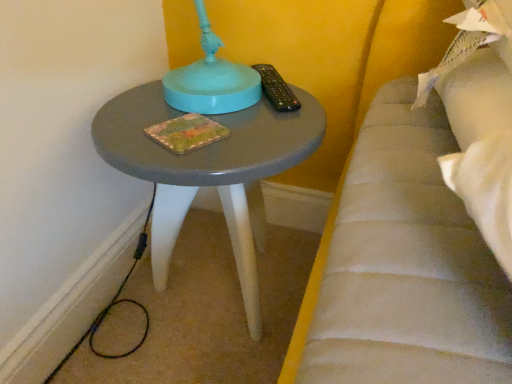
What do you see at coordinates (209, 171) in the screenshot? Image resolution: width=512 pixels, height=384 pixels. I see `matte gray table at center` at bounding box center [209, 171].

Identify the location of matte gray table at center. This screenshot has height=384, width=512. (209, 171).

Identify the location of black plastic remote at upper right. (276, 89).

The width and height of the screenshot is (512, 384). What do you see at coordinates (276, 89) in the screenshot?
I see `black plastic remote at upper right` at bounding box center [276, 89].

Locate an element on the screen. The image size is (512, 384). matte gray table at center is located at coordinates (209, 171).

Does matte gray table at center appear on the left side of black plastic remote at upper right?

Yes.

Which is in front, matte gray table at center or black plastic remote at upper right?

matte gray table at center is closer to the camera.

Is point (153, 211) positioned before point (260, 66)?

That is False.

From the image's perspective, which is above, matte gray table at center or black plastic remote at upper right?

black plastic remote at upper right.

From a real-world perspective, between matte gray table at center and black plastic remote at upper right, who is vertically lower?

matte gray table at center is physically lower.

Is matte gray table at center wider than black plastic remote at upper right?

Correct, the width of matte gray table at center exceeds that of black plastic remote at upper right.

Considering the relative sizes of matte gray table at center and black plastic remote at upper right in the image provided, is matte gray table at center shorter than black plastic remote at upper right?

No, matte gray table at center is not shorter than black plastic remote at upper right.

Considering the sizes of objects matte gray table at center and black plastic remote at upper right in the image provided, who is smaller, matte gray table at center or black plastic remote at upper right?

With smaller size is black plastic remote at upper right.

Do you think matte gray table at center is within black plastic remote at upper right, or outside of it?

matte gray table at center is spatially situated outside black plastic remote at upper right.

Can you see matte gray table at center touching black plastic remote at upper right?

No, matte gray table at center is not next to black plastic remote at upper right.

Is matte gray table at center positioned with its back to black plastic remote at upper right?

matte gray table at center is not turned away from black plastic remote at upper right.

Based on the photo, how far apart are matte gray table at center and black plastic remote at upper right?

matte gray table at center is 8.17 inches away from black plastic remote at upper right.

Locate an element on the screen. table below the black plastic remote at upper right (from a real-world perspective) is located at coordinates (209, 171).

Considering the positions of objects black plastic remote at upper right and matte gray table at center in the image provided, who is more to the left, black plastic remote at upper right or matte gray table at center?

From the viewer's perspective, matte gray table at center appears more on the left side.

Relative to matte gray table at center, is black plastic remote at upper right in front or behind?

Clearly, black plastic remote at upper right is behind matte gray table at center.

Considering the positions of point (274, 77) and point (119, 152), is point (274, 77) closer or farther from the camera than point (119, 152)?

Point (274, 77) appears to be farther away from the viewer than point (119, 152).

From the image's perspective, between black plastic remote at upper right and matte gray table at center, who is located below?

matte gray table at center is shown below in the image.

From a real-world perspective, does black plastic remote at upper right sit lower than matte gray table at center?

Actually, black plastic remote at upper right is physically above matte gray table at center in the real world.

Which of these two, black plastic remote at upper right or matte gray table at center, is wider?

Wider between the two is matte gray table at center.

Between black plastic remote at upper right and matte gray table at center, which one has more height?

matte gray table at center is taller.

Between black plastic remote at upper right and matte gray table at center, which one has smaller size?

black plastic remote at upper right.

Would you say black plastic remote at upper right is outside matte gray table at center?

Yes, black plastic remote at upper right is not within matte gray table at center.

Is black plastic remote at upper right directly adjacent to matte gray table at center?

black plastic remote at upper right and matte gray table at center are not in contact.

Is black plastic remote at upper right positioned with its back to matte gray table at center?

black plastic remote at upper right does not have its back to matte gray table at center.

Consider the image. How many degrees apart are the facing directions of black plastic remote at upper right and matte gray table at center?

The facing directions of black plastic remote at upper right and matte gray table at center are 31.7 degrees apart.

You are a GUI agent. You are given a task and a screenshot of the screen. Output one action in this format:
    pyautogui.click(x=<x>, y=<y>)
    Task: Click on the remote that appears above the matte gray table at center (from the image's perspective)
    
    Given the screenshot: What is the action you would take?
    pyautogui.click(x=276, y=89)

Locate an element on the screen. remote above the matte gray table at center (from a real-world perspective) is located at coordinates (276, 89).

Find the location of `table on the left of black plastic remote at upper right`. table on the left of black plastic remote at upper right is located at coordinates (209, 171).